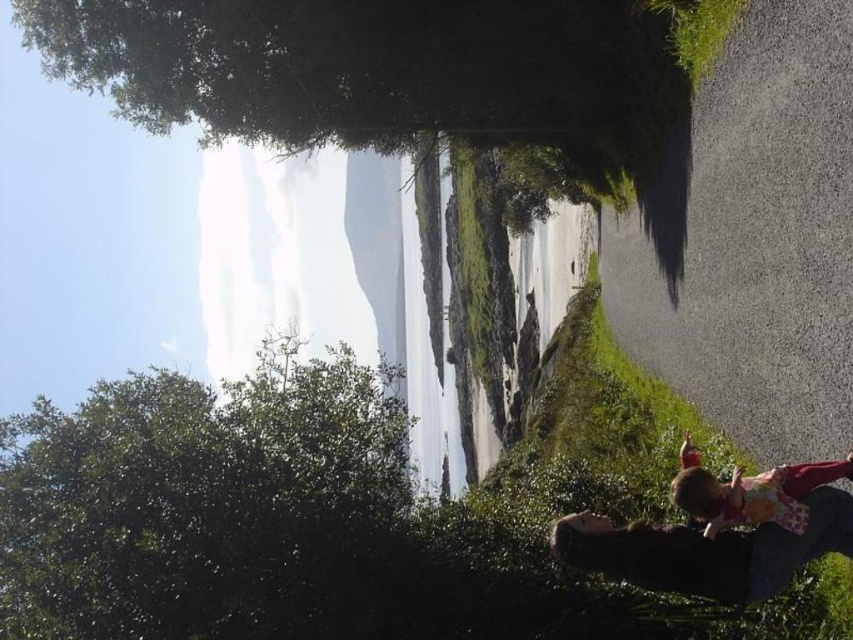
Does green leafy tree at upper left have a greater height compared to floral dress at lower right?

Indeed, green leafy tree at upper left has a greater height compared to floral dress at lower right.

Is the position of green leafy tree at upper left more distant than that of floral dress at lower right?

Yes.

Is point (148, 426) positioned behind point (747, 518)?

That is True.

Identify the location of green leafy tree at upper left. (207, 506).